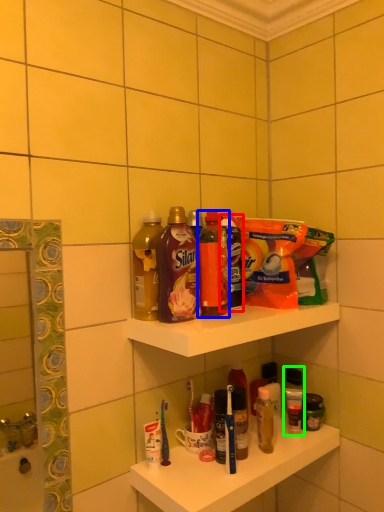
Question: Which object is the closest to the cleaning product (highlighted by a red box)? Choose among these: bottle (highlighted by a blue box) or toiletry (highlighted by a green box).

Choices:
 (A) bottle
 (B) toiletry

Answer: (A)